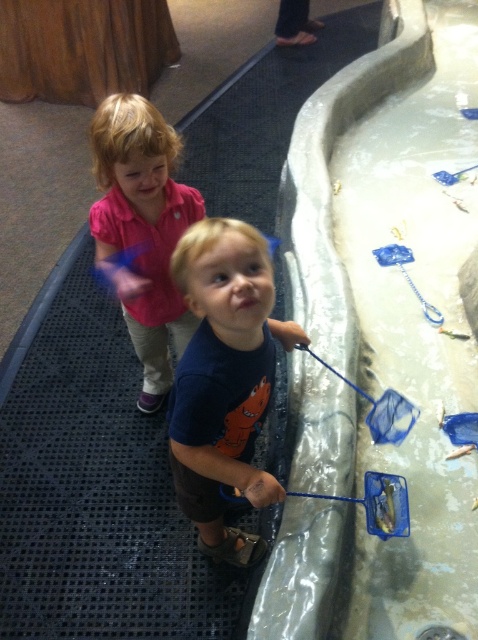
Question: Does blue cotton shirt at center appear over pink cotton shirt at upper left?

Choices:
 (A) no
 (B) yes

Answer: (A)

Question: Which of the following is the closest to the observer?

Choices:
 (A) (226, 388)
 (B) (162, 342)
 (C) (310, 538)

Answer: (A)

Question: Which point is closer to the camera?

Choices:
 (A) pos(152,250)
 (B) pos(375,636)

Answer: (B)

Question: From the image, what is the correct spatial relationship of clear plastic water at upper right in relation to pink cotton shirt at upper left?

Choices:
 (A) below
 (B) above

Answer: (B)

Question: Is clear plastic water at upper right above pink cotton shirt at upper left?

Choices:
 (A) yes
 (B) no

Answer: (A)

Question: Among these objects, which one is nearest to the camera?

Choices:
 (A) pink cotton shirt at upper left
 (B) blue cotton shirt at center

Answer: (B)